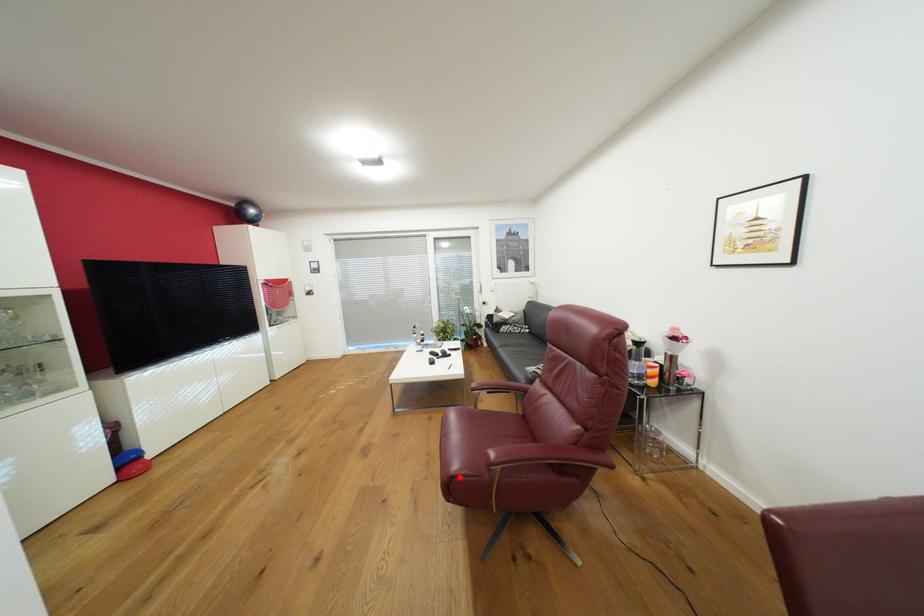
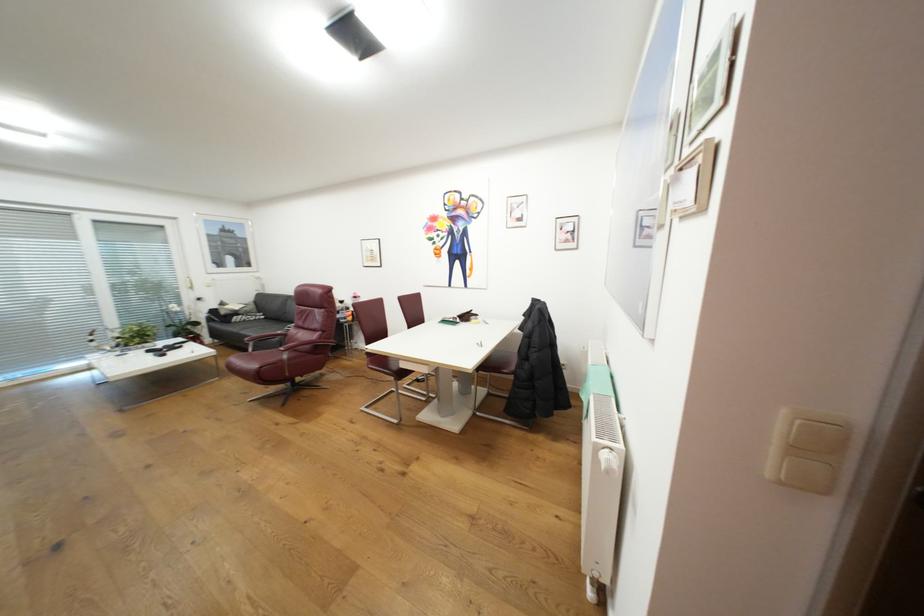
The point at the highlighted location is marked in the first image. Where is the corresponding point in the second image?

(268, 368)